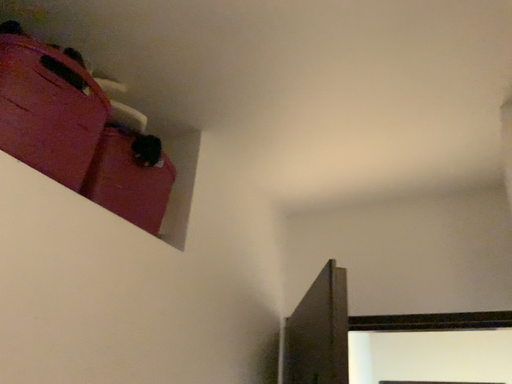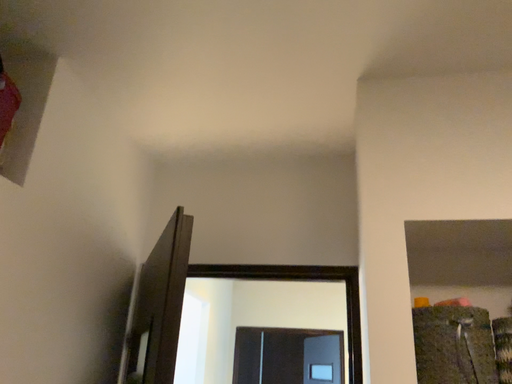
Question: How did the camera likely rotate when shooting the video?

Choices:
 (A) rotated upward
 (B) rotated downward

Answer: (B)